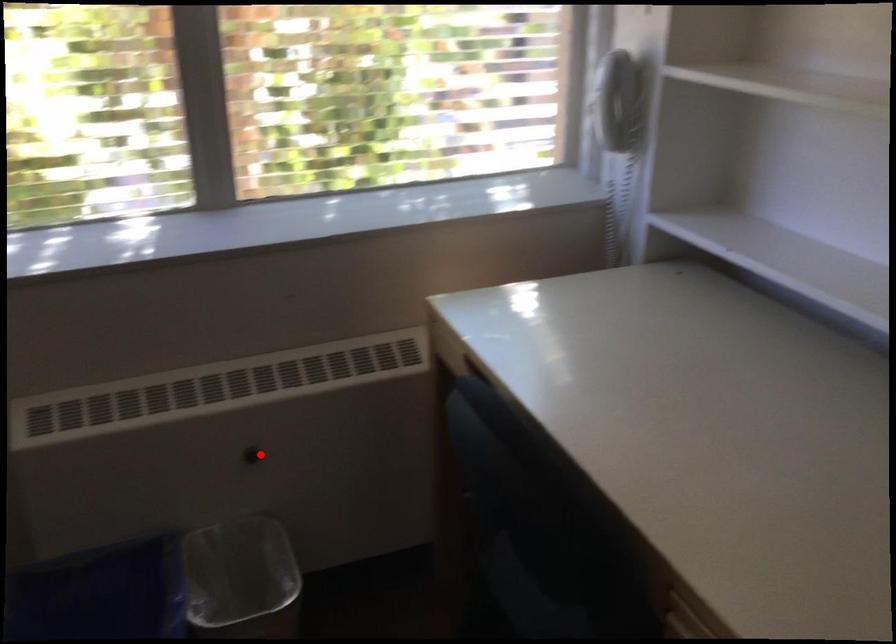
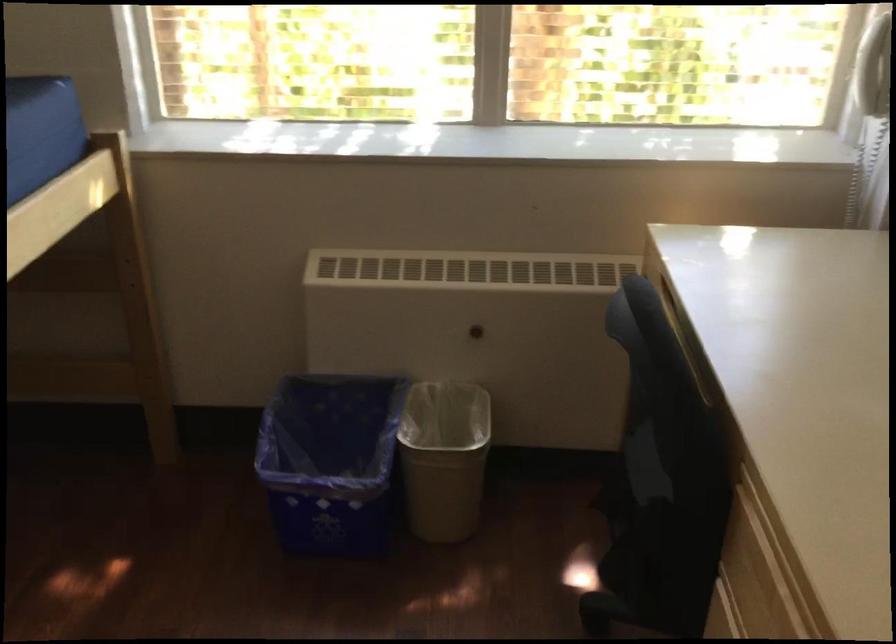
Question: I am providing you with two images of the same scene from different viewpoints. A red point is shown in image1. For the corresponding object point in image2, is it positioned nearer or farther from the camera?

Choices:
 (A) Nearer
 (B) Farther

Answer: (B)